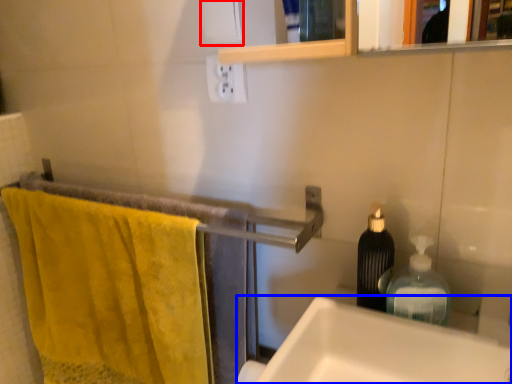
Question: Which of the following is the farthest to the observer, toilet paper (highlighted by a red box) or sink (highlighted by a blue box)?

Choices:
 (A) toilet paper
 (B) sink

Answer: (A)